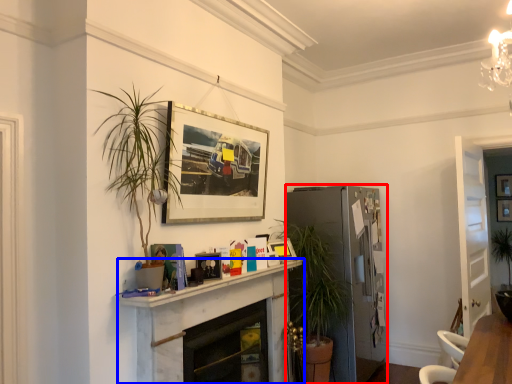
Question: Which point is further to the camera, fridge (highlighted by a red box) or fireplace (highlighted by a blue box)?

Choices:
 (A) fridge
 (B) fireplace

Answer: (A)